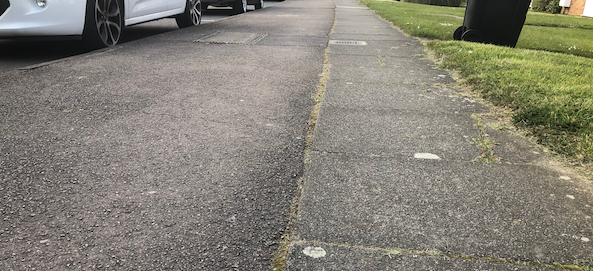
Locate an element on the screen. The image size is (593, 271). black trash can is located at coordinates (487, 23).